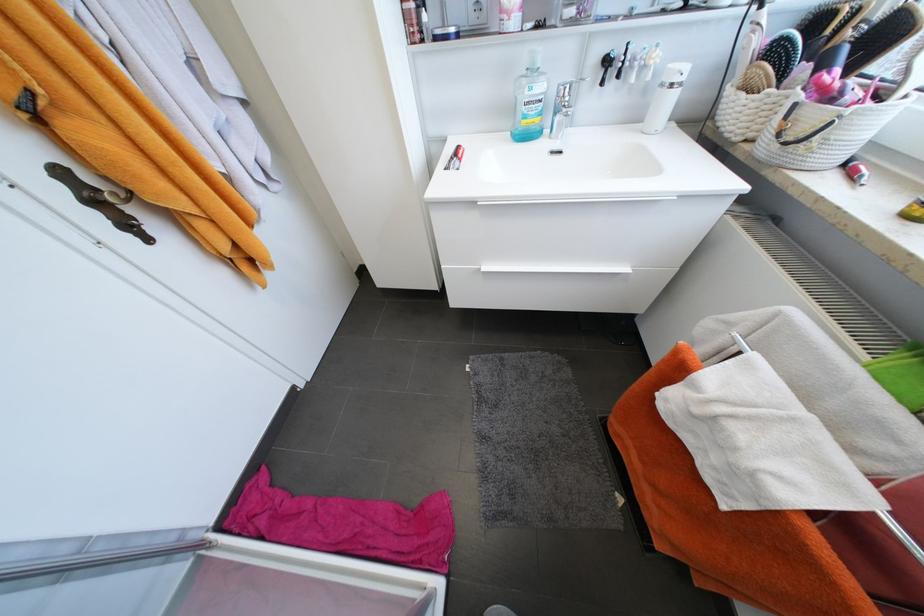
What do you see at coordinates (553, 270) in the screenshot? I see `a bottom drawer handle` at bounding box center [553, 270].